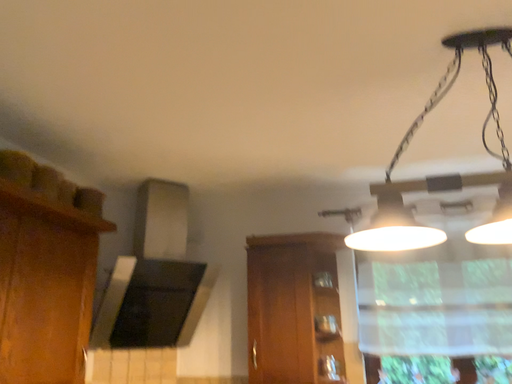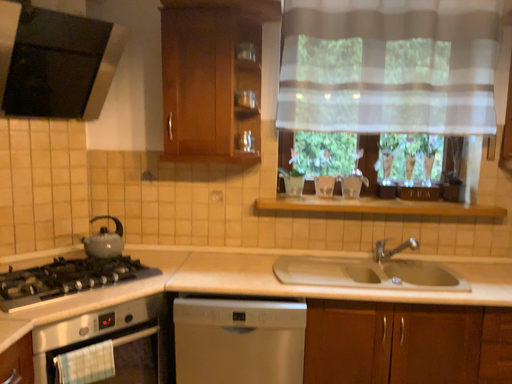
Question: Which way did the camera rotate in the video?

Choices:
 (A) rotated upward
 (B) rotated downward

Answer: (B)